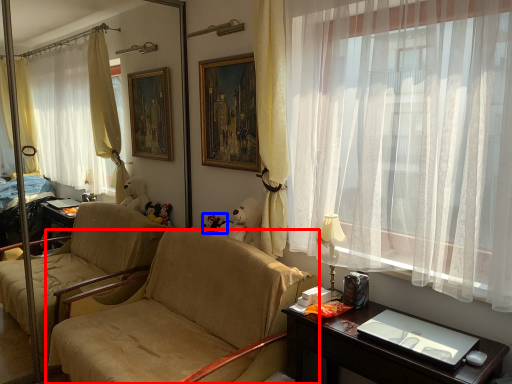
Question: Which of the following is the farthest to the observer, chair (highlighted by a red box) or toy (highlighted by a blue box)?

Choices:
 (A) chair
 (B) toy

Answer: (B)